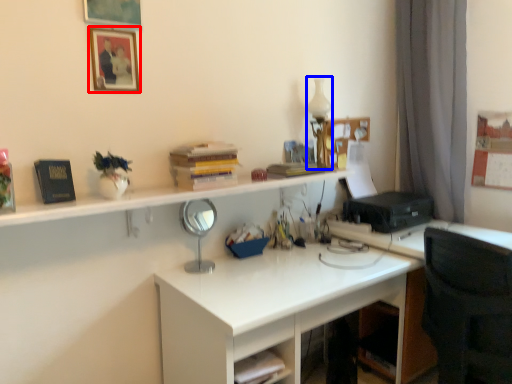
Question: Which of the following is the farthest to the observer, picture frame (highlighted by a red box) or table lamp (highlighted by a blue box)?

Choices:
 (A) picture frame
 (B) table lamp

Answer: (B)